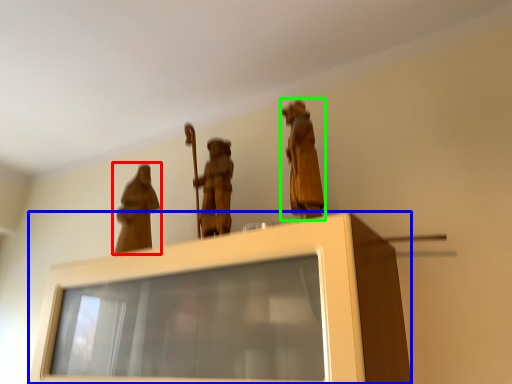
Question: Which is farther away from person (highlighted by a red box)? furniture (highlighted by a blue box) or person (highlighted by a green box)?

Choices:
 (A) furniture
 (B) person

Answer: (B)